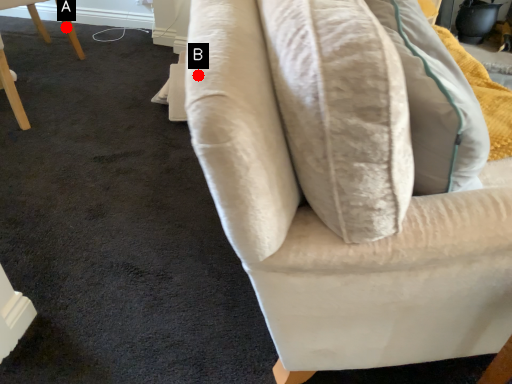
Question: Two points are circled on the image, labeled by A and B beside each circle. Which point appears closest to the camera in this image?

Choices:
 (A) A is closer
 (B) B is closer

Answer: (B)